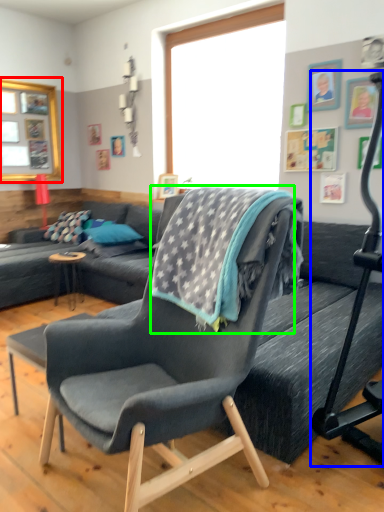
Question: Considering the real-world distances, which object is farthest from window screen (highlighted by a red box)? baby carriage (highlighted by a blue box) or blanket (highlighted by a green box)?

Choices:
 (A) baby carriage
 (B) blanket

Answer: (A)